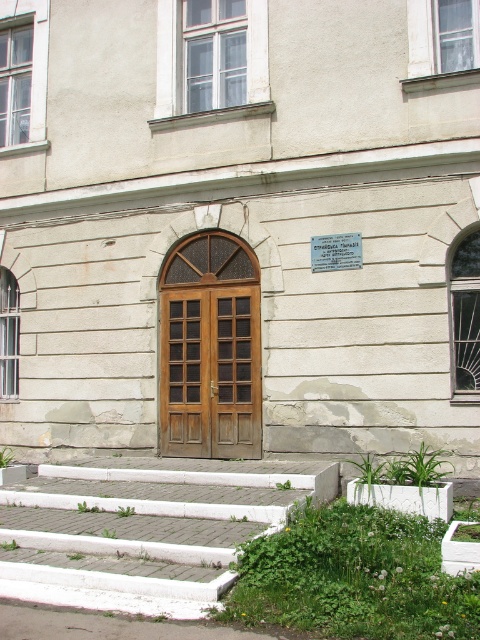
You are standing at the base of the white concrete stairs at lower center and want to enter the wooden door at center. Which direction should you move to reach the door?

Since the white concrete stairs at lower center are closer to the viewer than the wooden door at center, you should move forward towards the door to reach it.

You are standing in front of the building and want to take a photo. You notice two points marked on the facade. The first point is at coordinate point (189, 600) and the second is at point (231, 449). Which point will appear larger in your camera view?

Point (189, 600) is closer to the camera than point (231, 449), so it will appear larger in the camera view.